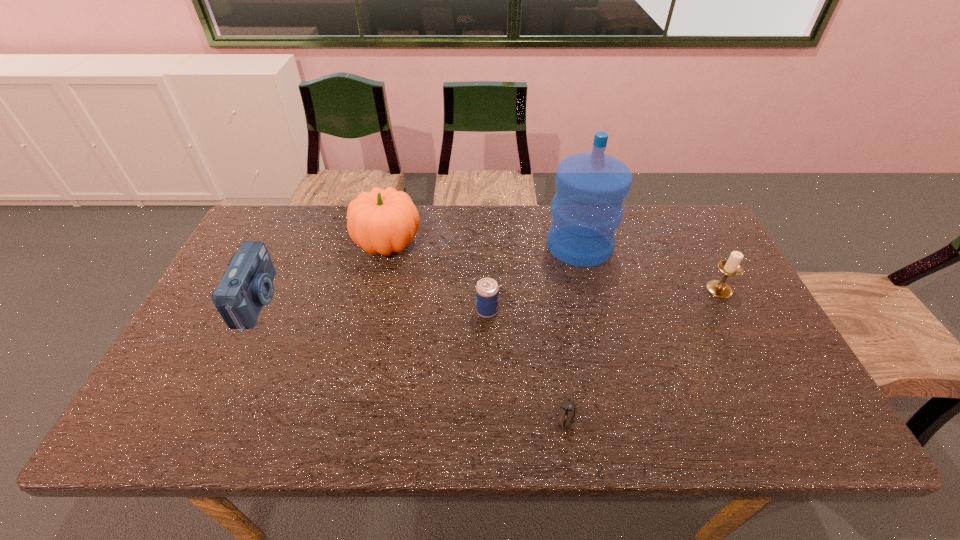
This screenshot has height=540, width=960. What are the coordinates of `blank area located on the front of the fifth shortest object` in the screenshot? It's located at (378, 287).

The width and height of the screenshot is (960, 540). What are the coordinates of `free space located on the left of the candle holder` in the screenshot? It's located at (650, 289).

Where is `free space located on the lens of the leftmost object`? free space located on the lens of the leftmost object is located at coordinates (299, 301).

At what (x,y) coordinates should I click in order to perform the action: click on free region located on the back of the beer can. Please return your answer as a coordinate pair (x, y). This screenshot has width=960, height=540. Looking at the image, I should click on (487, 279).

Identify the location of free location located on the right of the computer mouse. The image size is (960, 540). (671, 416).

Find the location of a particular element. Image resolution: width=960 pixels, height=540 pixels. water jug that is at the far edge is located at coordinates (587, 209).

Where is `pumpkin located at the far edge`? Image resolution: width=960 pixels, height=540 pixels. pumpkin located at the far edge is located at coordinates (380, 221).

The width and height of the screenshot is (960, 540). What are the coordinates of `object situated at the near edge` in the screenshot? It's located at (567, 409).

Where is `object that is at the left edge`? This screenshot has width=960, height=540. object that is at the left edge is located at coordinates (247, 285).

Find the location of a particular element. The image size is (960, 540). object that is at the right edge is located at coordinates (731, 267).